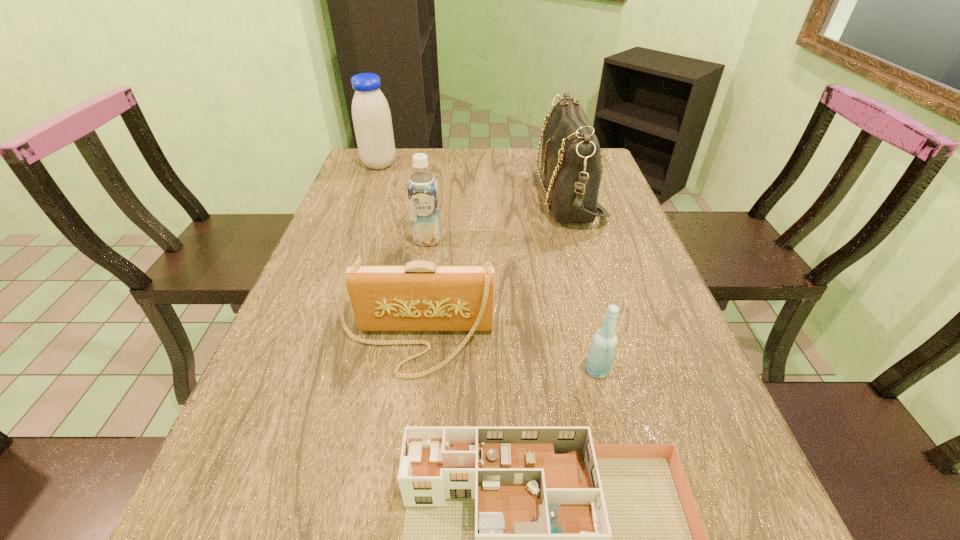
Identify the location of the farther soya milk. (371, 115).

Locate an element on the screen. the left soya milk is located at coordinates (371, 115).

Identify the location of the taller handbag. Image resolution: width=960 pixels, height=540 pixels. (571, 155).

This screenshot has height=540, width=960. I want to click on the farther handbag, so click(x=571, y=155).

Where is `the shorter soya milk`? The width and height of the screenshot is (960, 540). the shorter soya milk is located at coordinates (423, 197).

Locate an element on the screen. This screenshot has width=960, height=540. the nearer soya milk is located at coordinates (423, 197).

Find the location of `the left handbag`. the left handbag is located at coordinates (420, 296).

I want to click on the shorter handbag, so click(420, 296).

In order to click on bottle in this screenshot , I will do `click(604, 343)`.

Find the location of a particular element. free spot located on the front of the taller soya milk is located at coordinates (358, 222).